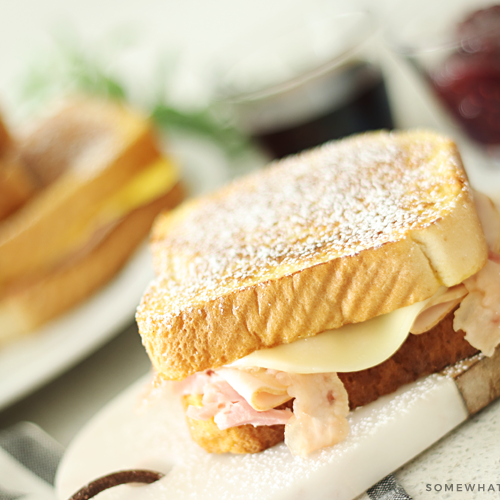
In order to click on cup in this screenshot , I will do `click(356, 86)`.